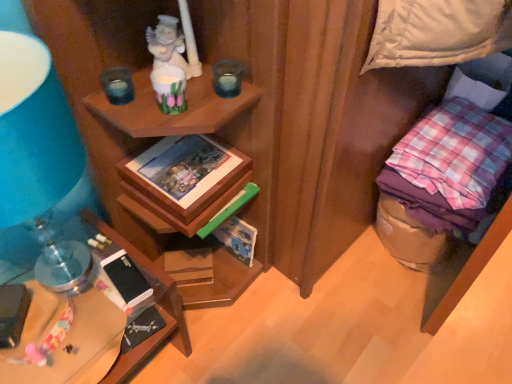
Identify the location of vacant region in front of brown cardboard magazine at lower center. (202, 324).